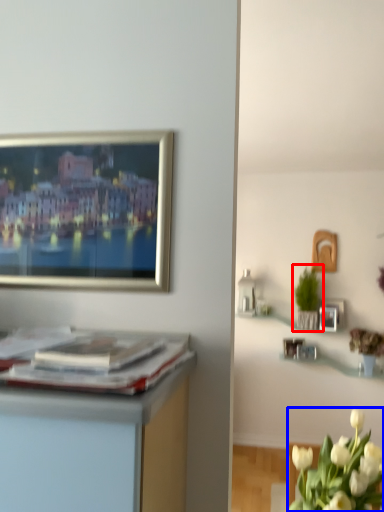
Question: Which of the following is the farthest to the observer, houseplant (highlighted by a red box) or flower (highlighted by a blue box)?

Choices:
 (A) houseplant
 (B) flower

Answer: (A)